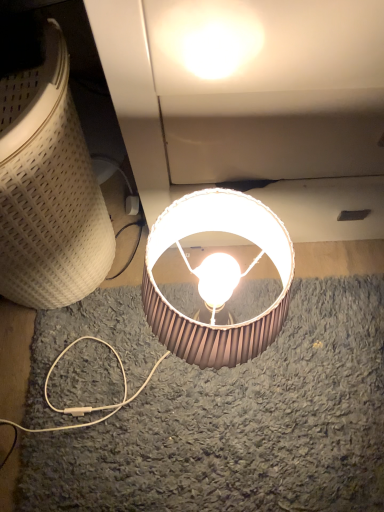
Question: Considering the relative sizes of metallic silver lampshade at center, the 1th lamp when ordered from right to left, and matte white lampshade at lower left, placed as the 1th lamp when sorted from left to right, in the image provided, is metallic silver lampshade at center, the 1th lamp when ordered from right to left, bigger than matte white lampshade at lower left, placed as the 1th lamp when sorted from left to right,?

Choices:
 (A) yes
 (B) no

Answer: (B)

Question: Is metallic silver lampshade at center, the 1th lamp when ordered from right to left, positioned behind matte white lampshade at lower left, the 2th lamp positioned from the right?

Choices:
 (A) yes
 (B) no

Answer: (A)

Question: Does metallic silver lampshade at center, placed as the second lamp when sorted from left to right, have a greater width compared to matte white lampshade at lower left, the 2th lamp positioned from the right?

Choices:
 (A) yes
 (B) no

Answer: (B)

Question: Is metallic silver lampshade at center, the 1th lamp when ordered from right to left, next to matte white lampshade at lower left, the 2th lamp positioned from the right, and touching it?

Choices:
 (A) yes
 (B) no

Answer: (B)

Question: Does metallic silver lampshade at center, the 1th lamp when ordered from right to left, have a lesser width compared to matte white lampshade at lower left, the 2th lamp positioned from the right?

Choices:
 (A) no
 (B) yes

Answer: (B)

Question: From a real-world perspective, is metallic silver lampshade at center, the 1th lamp when ordered from right to left, over matte white lampshade at lower left, the 2th lamp positioned from the right?

Choices:
 (A) no
 (B) yes

Answer: (A)

Question: From the image's perspective, is matte white lampshade at lower left, the 2th lamp positioned from the right, under metallic silver lampshade at center, the 1th lamp when ordered from right to left?

Choices:
 (A) yes
 (B) no

Answer: (B)

Question: Is matte white lampshade at lower left, placed as the 1th lamp when sorted from left to right, wider than metallic silver lampshade at center, placed as the second lamp when sorted from left to right?

Choices:
 (A) yes
 (B) no

Answer: (A)

Question: Considering the relative sizes of matte white lampshade at lower left, the 2th lamp positioned from the right, and metallic silver lampshade at center, the 1th lamp when ordered from right to left, in the image provided, is matte white lampshade at lower left, the 2th lamp positioned from the right, shorter than metallic silver lampshade at center, the 1th lamp when ordered from right to left,?

Choices:
 (A) yes
 (B) no

Answer: (B)

Question: Does matte white lampshade at lower left, placed as the 1th lamp when sorted from left to right, have a lesser width compared to metallic silver lampshade at center, the 1th lamp when ordered from right to left?

Choices:
 (A) no
 (B) yes

Answer: (A)

Question: Is matte white lampshade at lower left, the 2th lamp positioned from the right, in front of metallic silver lampshade at center, placed as the second lamp when sorted from left to right?

Choices:
 (A) yes
 (B) no

Answer: (A)

Question: Can you confirm if matte white lampshade at lower left, placed as the 1th lamp when sorted from left to right, is taller than metallic silver lampshade at center, the 1th lamp when ordered from right to left?

Choices:
 (A) yes
 (B) no

Answer: (A)

Question: Is matte white lampshade at lower left, placed as the 1th lamp when sorted from left to right, in front of or behind metallic silver lampshade at center, placed as the second lamp when sorted from left to right, in the image?

Choices:
 (A) behind
 (B) front

Answer: (B)